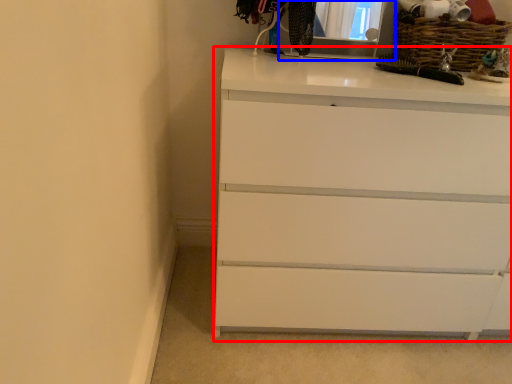
Question: Among these objects, which one is farthest to the camera, chest of drawers (highlighted by a red box) or medicine cabinet (highlighted by a blue box)?

Choices:
 (A) chest of drawers
 (B) medicine cabinet

Answer: (B)